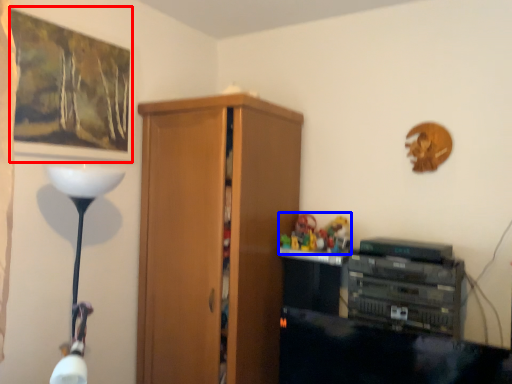
Question: Which point is further to the camera, picture frame (highlighted by a red box) or toy (highlighted by a blue box)?

Choices:
 (A) picture frame
 (B) toy

Answer: (B)